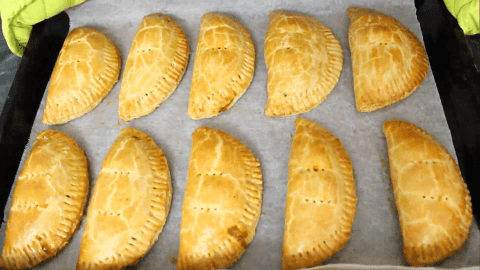
This screenshot has width=480, height=270. What are the coordinates of `blanket` in the screenshot? It's located at (22, 8).